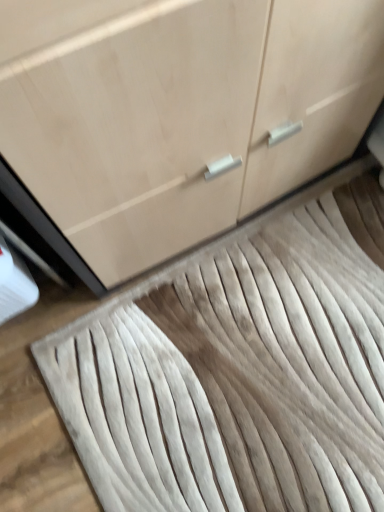
Question: From a real-world perspective, does white textured rug at center sit lower than matte wood cabinet at center?

Choices:
 (A) yes
 (B) no

Answer: (A)

Question: Is white textured rug at center far from matte wood cabinet at center?

Choices:
 (A) yes
 (B) no

Answer: (B)

Question: Would you say matte wood cabinet at center is part of white textured rug at center's contents?

Choices:
 (A) yes
 (B) no

Answer: (B)

Question: From the image's perspective, does white textured rug at center appear lower than matte wood cabinet at center?

Choices:
 (A) no
 (B) yes

Answer: (B)

Question: Is white textured rug at center placed right next to matte wood cabinet at center?

Choices:
 (A) yes
 (B) no

Answer: (B)

Question: Does white textured rug at center lie behind matte wood cabinet at center?

Choices:
 (A) no
 (B) yes

Answer: (B)

Question: Considering the relative sizes of matte wood cabinet at center and white textured rug at center in the image provided, is matte wood cabinet at center wider than white textured rug at center?

Choices:
 (A) yes
 (B) no

Answer: (B)

Question: From the image's perspective, does matte wood cabinet at center appear lower than white textured rug at center?

Choices:
 (A) yes
 (B) no

Answer: (B)

Question: Are matte wood cabinet at center and white textured rug at center making contact?

Choices:
 (A) no
 (B) yes

Answer: (A)

Question: Can you confirm if matte wood cabinet at center is bigger than white textured rug at center?

Choices:
 (A) yes
 (B) no

Answer: (A)

Question: Is matte wood cabinet at center not inside white textured rug at center?

Choices:
 (A) no
 (B) yes

Answer: (B)

Question: Can you confirm if matte wood cabinet at center is taller than white textured rug at center?

Choices:
 (A) no
 (B) yes

Answer: (B)

Question: Looking at their shapes, would you say matte wood cabinet at center is wider or thinner than white textured rug at center?

Choices:
 (A) thin
 (B) wide

Answer: (A)